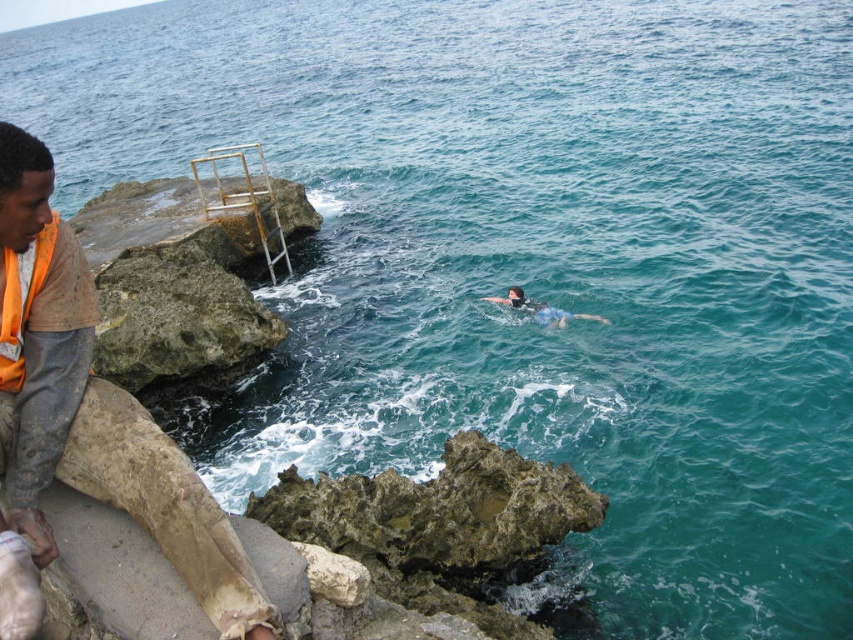
Question: Does orange fabric shirt at left have a greater width compared to blue rubber at center?

Choices:
 (A) no
 (B) yes

Answer: (A)

Question: Which point is farther from the camera taking this photo?

Choices:
 (A) (527, 308)
 (B) (57, 237)
 (C) (44, 234)

Answer: (A)

Question: Can you confirm if orange fabric shirt at left is positioned to the right of blue rubber at center?

Choices:
 (A) yes
 (B) no

Answer: (B)

Question: Is orange fabric life jacket at left to the left of blue rubber at center from the viewer's perspective?

Choices:
 (A) no
 (B) yes

Answer: (B)

Question: Which object is the closest to the orange fabric shirt at left?

Choices:
 (A) orange fabric life jacket at left
 (B) blue rubber at center

Answer: (A)

Question: Which point is farther from the camera taking this photo?

Choices:
 (A) (3, 196)
 (B) (28, 259)

Answer: (B)